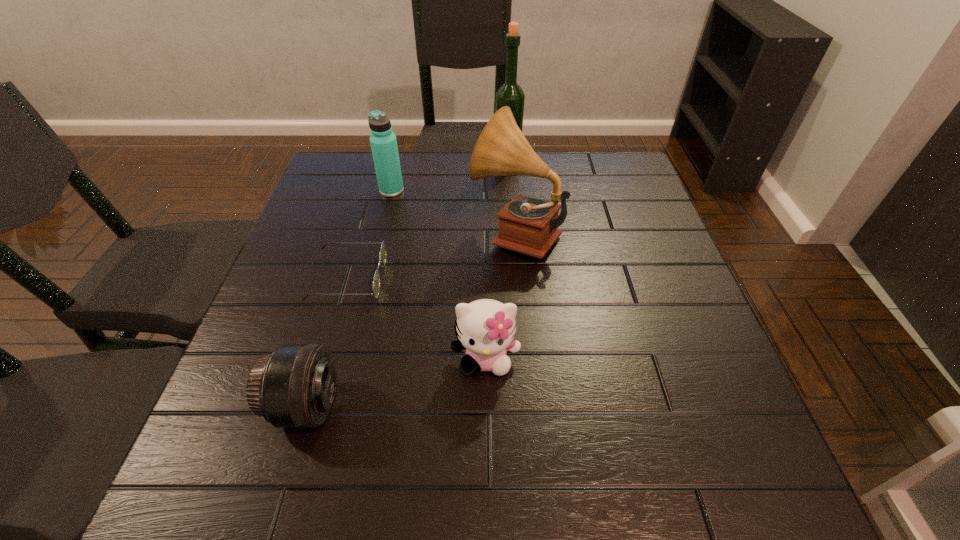
Find the location of `vacant space at the far edge`. vacant space at the far edge is located at coordinates (468, 193).

I want to click on vacant space at the near edge of the desktop, so click(x=317, y=505).

I want to click on free space at the left edge, so click(348, 214).

At what (x,y) coordinates should I click in order to perform the action: click on vacant space at the right edge. Please return your answer as a coordinate pair (x, y). The image size is (960, 540). Looking at the image, I should click on (620, 230).

Locate an element on the screen. Image resolution: width=960 pixels, height=540 pixels. vacant space at the far left corner is located at coordinates (323, 198).

You are a GUI agent. You are given a task and a screenshot of the screen. Output one action in this format:
    pyautogui.click(x=<x>, y=<y>)
    Task: Click on the vacant area at the near left corner
    
    Given the screenshot: What is the action you would take?
    pyautogui.click(x=267, y=469)

At what (x,y) coordinates should I click in order to perform the action: click on vacant region at the far right corner of the desktop. Please return your answer as a coordinate pair (x, y). The width and height of the screenshot is (960, 540). Looking at the image, I should click on (606, 185).

The height and width of the screenshot is (540, 960). Identify the location of free space at the near right corner of the desktop. (777, 488).

In order to click on free space between the kitten and the phonograph record in this screenshot , I will do `click(500, 295)`.

Image resolution: width=960 pixels, height=540 pixels. In order to click on free space between the thermos bottle and the liquor in this screenshot , I will do `click(449, 175)`.